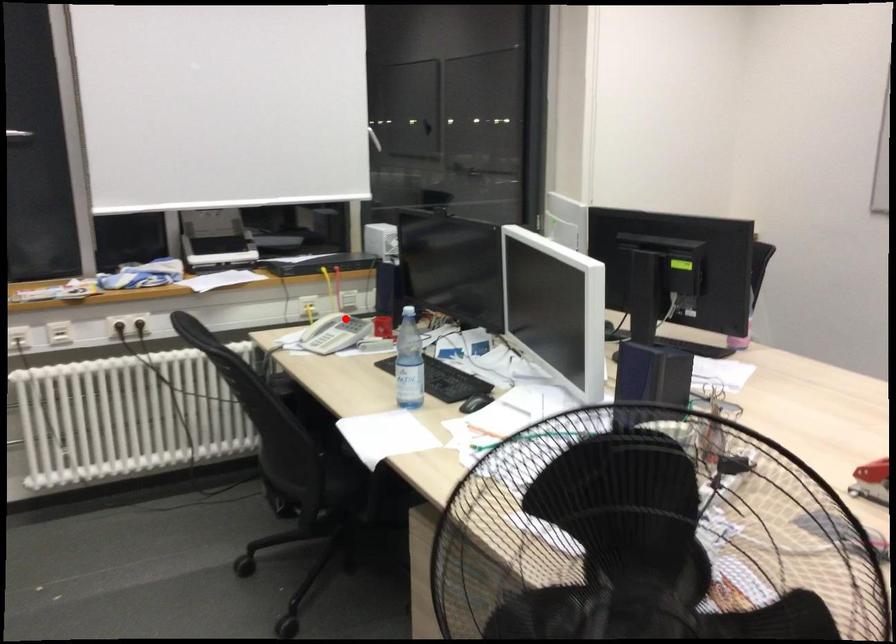
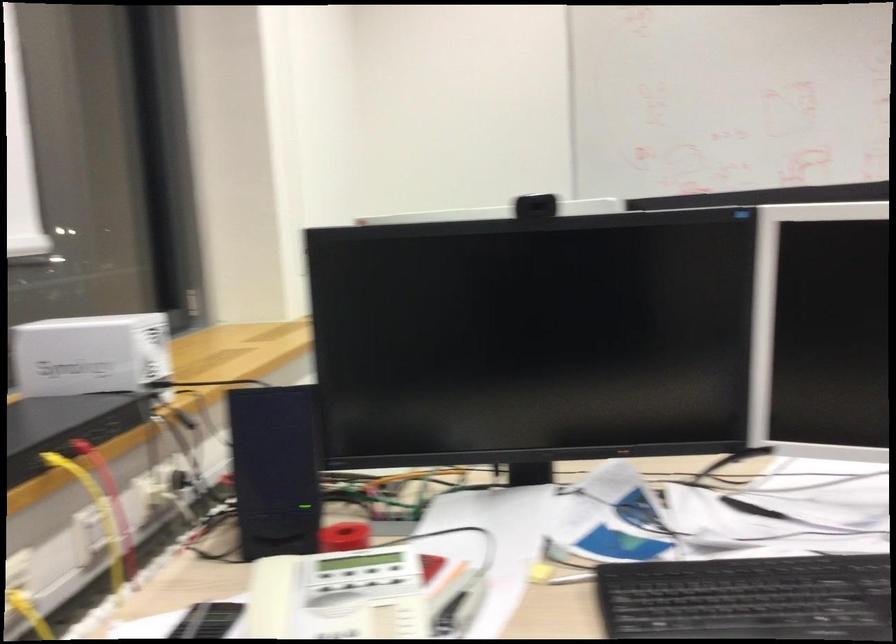
The point at the highlighted location is marked in the first image. Where is the corresponding point in the second image?

(352, 581)